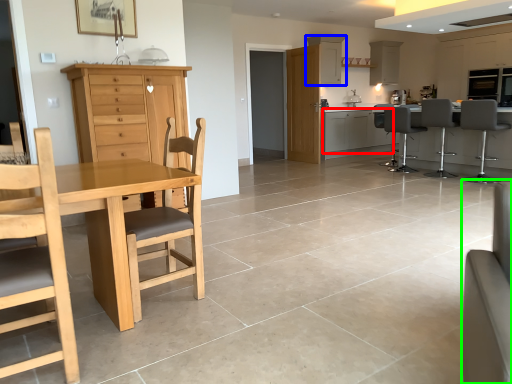
Question: Considering the real-world distances, which object is closest to cabinetry (highlighted by a red box)? cabinetry (highlighted by a blue box) or couch (highlighted by a green box).

Choices:
 (A) cabinetry
 (B) couch

Answer: (A)